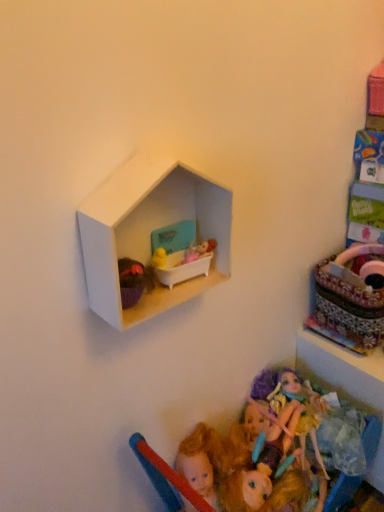
Where is `multicolored plush doll at lower center`? Image resolution: width=384 pixels, height=512 pixels. multicolored plush doll at lower center is located at coordinates (228, 457).

Find the location of a particular element. This screenshot has width=384, height=512. patterned fabric basket at right is located at coordinates (350, 298).

At what (x,y) coordinates should I click in order to perform the action: click on white matte hexagonal shelf at upper center. Please return your answer as a coordinate pair (x, y). Looking at the image, I should click on (149, 232).

Where is `matte plastic bathtub at upper center`? The image size is (384, 512). matte plastic bathtub at upper center is located at coordinates (186, 263).

Where is `multicolored plush doll at lower center`? multicolored plush doll at lower center is located at coordinates (228, 457).

Is multicolored plush doll at lower center at the back of patterned fabric basket at right?

No, patterned fabric basket at right's orientation is not away from multicolored plush doll at lower center.

Which is correct: patterned fabric basket at right is inside multicolored plush doll at lower center, or outside of it?

patterned fabric basket at right is not inside multicolored plush doll at lower center, it's outside.

Is patterned fabric basket at right far from multicolored plush doll at lower center?

patterned fabric basket at right is near multicolored plush doll at lower center, not far away.

Is patterned fabric basket at right positioned behind multicolored plush doll at lower center?

Yes, it is behind multicolored plush doll at lower center.

Which is more to the left, multicolored plush doll at lower center or patterned fabric basket at right?

multicolored plush doll at lower center is more to the left.

Is multicolored plush doll at lower center positioned with its back to patterned fabric basket at right?

No.

Is multicolored plush doll at lower center located outside patterned fabric basket at right?

Yes, multicolored plush doll at lower center is outside of patterned fabric basket at right.

Where is `doll that appears below the patterned fabric basket at right (from the image's perspective)`? doll that appears below the patterned fabric basket at right (from the image's perspective) is located at coordinates (228, 457).

Who is taller, white matte hexagonal shelf at upper center or patterned fabric basket at right?

patterned fabric basket at right.

Does white matte hexagonal shelf at upper center have a smaller size compared to patterned fabric basket at right?

Indeed, white matte hexagonal shelf at upper center has a smaller size compared to patterned fabric basket at right.

Is white matte hexagonal shelf at upper center far away from patterned fabric basket at right?

They are positioned close to each other.

Does point (316, 434) come in front of point (229, 220)?

No, (316, 434) is further to viewer.

Is white matte hexagonal shelf at upper center surrounded by multicolored plush doll at lower center?

No, white matte hexagonal shelf at upper center is not a part of multicolored plush doll at lower center.

Considering the positions of objects multicolored plush doll at lower center and white matte hexagonal shelf at upper center in the image provided, who is behind, multicolored plush doll at lower center or white matte hexagonal shelf at upper center?

multicolored plush doll at lower center is behind.

I want to click on doll on the right of white matte hexagonal shelf at upper center, so click(228, 457).

Consider the image. Is multicolored plush doll at lower center not near matte plastic bathtub at upper center?

No, there isn't a large distance between multicolored plush doll at lower center and matte plastic bathtub at upper center.

I want to click on doll below the matte plastic bathtub at upper center (from the image's perspective), so click(x=228, y=457).

Considering the points (258, 381) and (191, 262), which point is behind, point (258, 381) or point (191, 262)?

The point (258, 381) is more distant.

Is patterned fabric basket at right aimed at white matte hexagonal shelf at upper center?

No, patterned fabric basket at right is not aimed at white matte hexagonal shelf at upper center.

Is patterned fabric basket at right taller than white matte hexagonal shelf at upper center?

Correct, patterned fabric basket at right is much taller as white matte hexagonal shelf at upper center.

From the image's perspective, who appears lower, patterned fabric basket at right or white matte hexagonal shelf at upper center?

patterned fabric basket at right is shown below in the image.

Considering the positions of objects patterned fabric basket at right and white matte hexagonal shelf at upper center in the image provided, who is more to the left, patterned fabric basket at right or white matte hexagonal shelf at upper center?

Positioned to the left is white matte hexagonal shelf at upper center.

In the image, is patterned fabric basket at right positioned in front of or behind matte plastic bathtub at upper center?

In the image, patterned fabric basket at right appears behind matte plastic bathtub at upper center.

From a real-world perspective, which is physically below, patterned fabric basket at right or matte plastic bathtub at upper center?

In real-world perspective, patterned fabric basket at right is lower.

You are a GUI agent. You are given a task and a screenshot of the screen. Output one action in this format:
    pyautogui.click(x=<x>, y=<y>)
    Task: Click on the basket on the right of multicolored plush doll at lower center
    This screenshot has height=512, width=384.
    Given the screenshot: What is the action you would take?
    pyautogui.click(x=350, y=298)

Image resolution: width=384 pixels, height=512 pixels. I want to click on doll on the left of the patterned fabric basket at right, so click(228, 457).

Considering their positions, is white matte hexagonal shelf at upper center positioned further to patterned fabric basket at right than matte plastic bathtub at upper center?

white matte hexagonal shelf at upper center lies further to patterned fabric basket at right than the other object.

Which object lies further to the anchor point matte plastic bathtub at upper center, white matte hexagonal shelf at upper center or multicolored plush doll at lower center?

multicolored plush doll at lower center lies further to matte plastic bathtub at upper center than the other object.

Looking at this image, estimate the real-world distances between objects in this image. Which object is closer to multicolored plush doll at lower center, white matte hexagonal shelf at upper center or matte plastic bathtub at upper center?

Based on the image, matte plastic bathtub at upper center appears to be nearer to multicolored plush doll at lower center.

Based on their spatial positions, is matte plastic bathtub at upper center or white matte hexagonal shelf at upper center closer to patterned fabric basket at right?

matte plastic bathtub at upper center lies closer to patterned fabric basket at right than the other object.

When comparing their distances from patterned fabric basket at right, does multicolored plush doll at lower center or white matte hexagonal shelf at upper center seem closer?

multicolored plush doll at lower center.

Based on their spatial positions, is matte plastic bathtub at upper center or patterned fabric basket at right closer to white matte hexagonal shelf at upper center?

matte plastic bathtub at upper center lies closer to white matte hexagonal shelf at upper center than the other object.

Considering their positions, is white matte hexagonal shelf at upper center positioned closer to matte plastic bathtub at upper center than patterned fabric basket at right?

Based on the image, white matte hexagonal shelf at upper center appears to be nearer to matte plastic bathtub at upper center.

Estimate the real-world distances between objects in this image. Which object is further from white matte hexagonal shelf at upper center, multicolored plush doll at lower center or matte plastic bathtub at upper center?

multicolored plush doll at lower center is further to white matte hexagonal shelf at upper center.

You are a GUI agent. You are given a task and a screenshot of the screen. Output one action in this format:
    pyautogui.click(x=<x>, y=<y>)
    Task: Click on the toy between white matte hexagonal shelf at upper center and multicolored plush doll at lower center vertically
    Image resolution: width=384 pixels, height=512 pixels.
    Given the screenshot: What is the action you would take?
    pyautogui.click(x=186, y=263)

Identify the location of doll between matte plastic bathtub at upper center and patterned fabric basket at right in the horizontal direction. (228, 457).

In order to click on toy between white matte hexagonal shelf at upper center and patterned fabric basket at right in the horizontal direction in this screenshot , I will do `click(186, 263)`.

Locate an element on the screen. The image size is (384, 512). doll between white matte hexagonal shelf at upper center and patterned fabric basket at right in the horizontal direction is located at coordinates (228, 457).